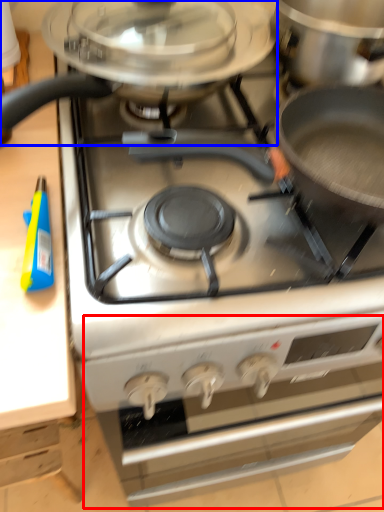
Question: Among these objects, which one is nearest to the camera, oven (highlighted by a red box) or kitchen appliance (highlighted by a blue box)?

Choices:
 (A) oven
 (B) kitchen appliance

Answer: (B)